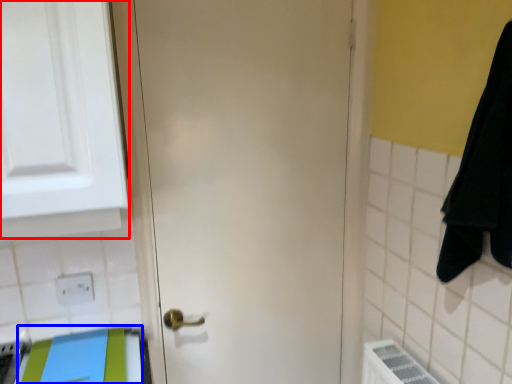
Question: Which point is further to the camera, medicine cabinet (highlighted by a red box) or beach towel (highlighted by a blue box)?

Choices:
 (A) medicine cabinet
 (B) beach towel

Answer: (B)